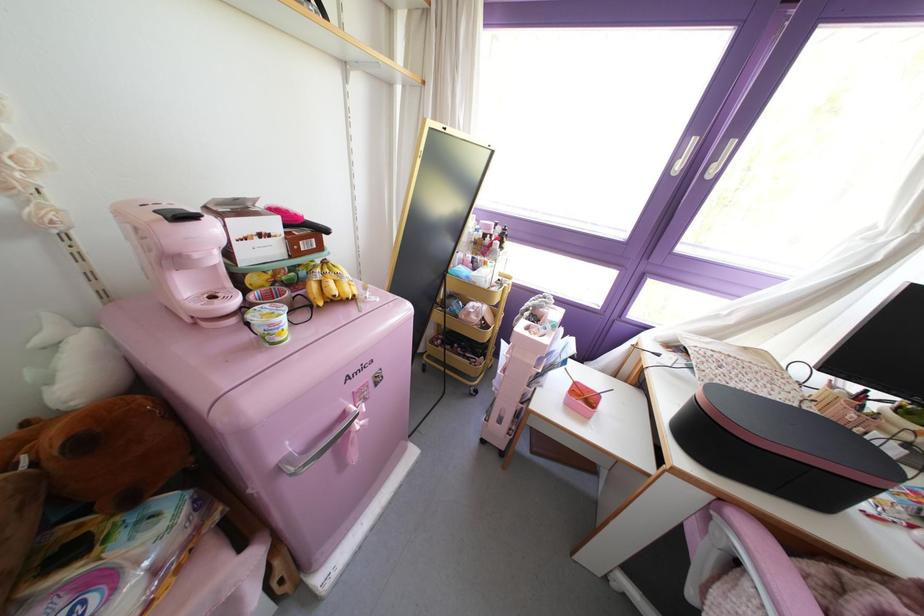
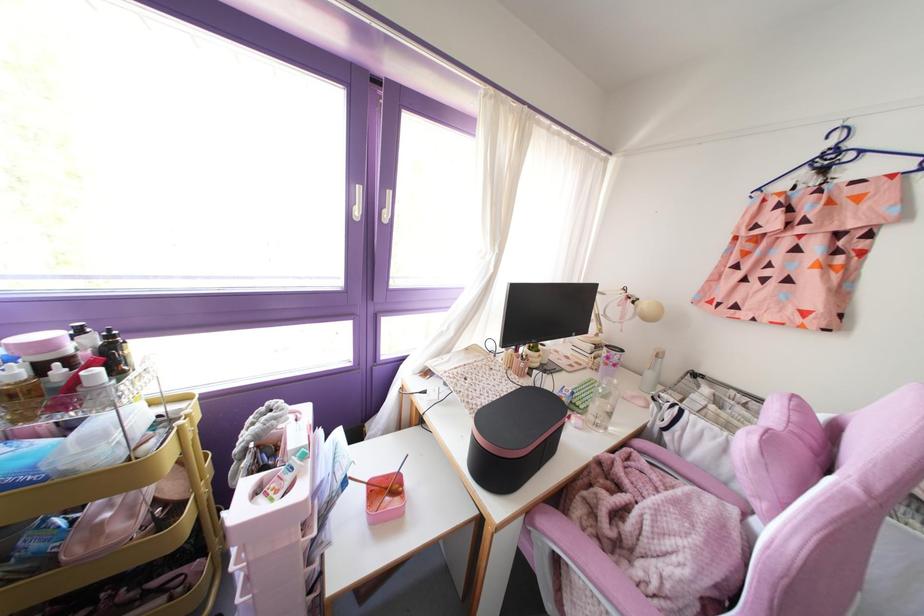
Where in the second image is the point corresponding to point 490,235 from the first image?

(67, 360)